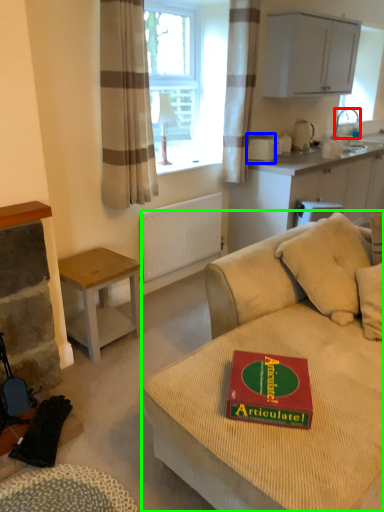
Question: Considering the real-world distances, which object is farthest from faucet (highlighted by a red box)? appliance (highlighted by a blue box) or studio couch (highlighted by a green box)?

Choices:
 (A) appliance
 (B) studio couch

Answer: (B)